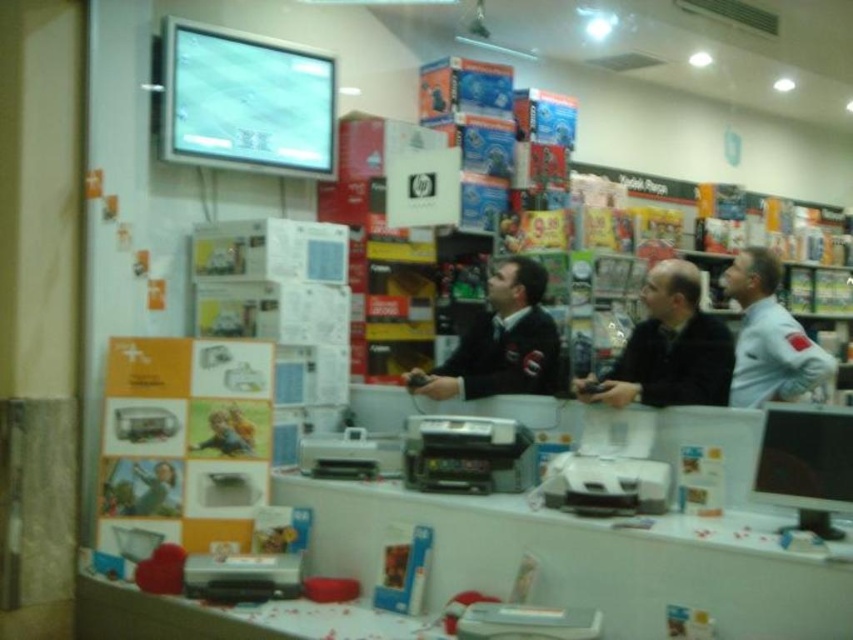
Question: Estimate the real-world distances between objects in this image. Which object is farther from the black matte shirt at center?

Choices:
 (A) white uniform at center
 (B) black matte jacket at center
 (C) orange matte poster at left
 (D) matte black monitor at center

Answer: (C)

Question: Estimate the real-world distances between objects in this image. Which object is closer to the black matte jacket at center?

Choices:
 (A) white uniform at center
 (B) orange matte poster at left
 (C) matte black monitor at center

Answer: (A)

Question: Which is farther from the matte black monitor at center?

Choices:
 (A) black matte shirt at center
 (B) orange matte poster at left

Answer: (B)

Question: From the image, what is the correct spatial relationship of orange matte poster at left in relation to black matte shirt at center?

Choices:
 (A) above
 (B) below

Answer: (B)

Question: Is orange matte poster at left to the right of black matte shirt at center from the viewer's perspective?

Choices:
 (A) yes
 (B) no

Answer: (B)

Question: Can you confirm if orange matte poster at left is positioned to the left of black matte shirt at center?

Choices:
 (A) no
 (B) yes

Answer: (B)